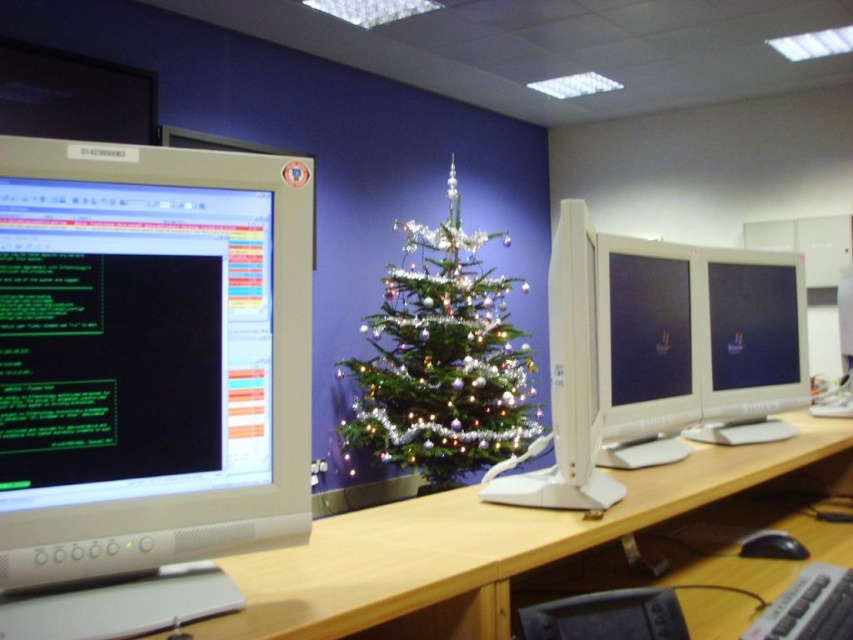
Between matte silver monitor at left and iridescent shiny christmas tree at center, which one has less height?

Standing shorter between the two is matte silver monitor at left.

Does matte silver monitor at left have a greater width compared to iridescent shiny christmas tree at center?

No, matte silver monitor at left is not wider than iridescent shiny christmas tree at center.

What are the coordinates of `matte silver monitor at left` in the screenshot? It's located at (148, 378).

You are a GUI agent. You are given a task and a screenshot of the screen. Output one action in this format:
    pyautogui.click(x=<x>, y=<y>)
    Task: Click on the matte silver monitor at left
    This screenshot has height=640, width=853.
    Given the screenshot: What is the action you would take?
    pyautogui.click(x=148, y=378)

Does matte white monitor at center have a smaller size compared to white glossy monitor at center?

No.

Which is below, matte white monitor at center or white glossy monitor at center?

white glossy monitor at center is below.

Is point (608, 429) closer to camera compared to point (575, 472)?

No, (608, 429) is behind (575, 472).

You are a GUI agent. You are given a task and a screenshot of the screen. Output one action in this format:
    pyautogui.click(x=<x>, y=<y>)
    Task: Click on the matte white monitor at center
    
    Given the screenshot: What is the action you would take?
    pyautogui.click(x=643, y=349)

The width and height of the screenshot is (853, 640). What do you see at coordinates (474, 548) in the screenshot?
I see `wooden at center` at bounding box center [474, 548].

Who is shorter, wooden at center or white glossy monitor at center?

wooden at center is shorter.

Which is behind, point (335, 548) or point (498, 481)?

Point (498, 481)

Where is `wooden at center`? The width and height of the screenshot is (853, 640). wooden at center is located at coordinates (x=474, y=548).